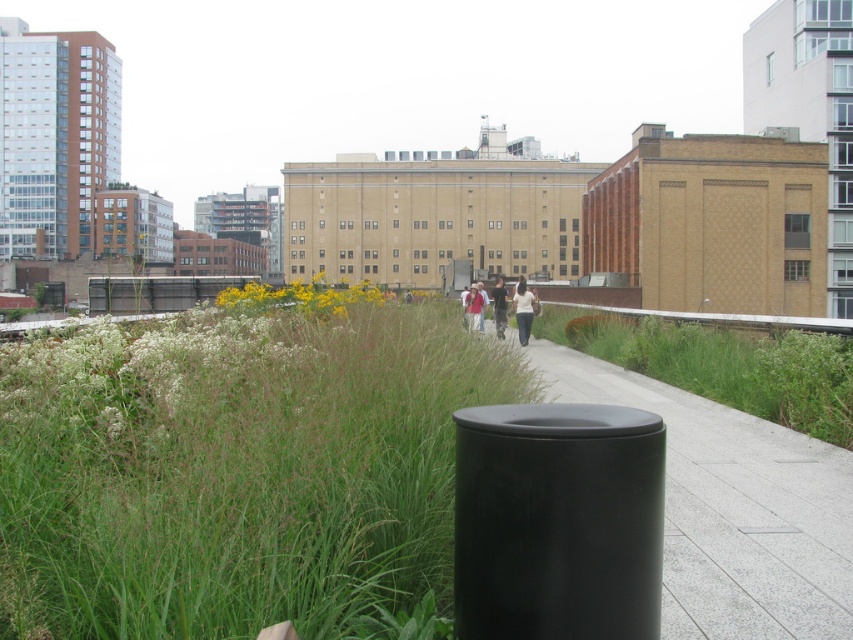
Question: Can you confirm if green grass at center is wider than dark blue shirt at center?

Choices:
 (A) yes
 (B) no

Answer: (B)

Question: Is black concrete pavement at center below dark blue shirt at center?

Choices:
 (A) yes
 (B) no

Answer: (A)

Question: Among these objects, which one is farthest from the camera?

Choices:
 (A) light brown leather jacket at center
 (B) yellow-green flowers at center
 (C) white matte jacket at center
 (D) black concrete pavement at center

Answer: (C)

Question: Which of the following is the farthest from the observer?

Choices:
 (A) (730, 538)
 (B) (517, 301)
 (C) (421, 323)

Answer: (B)

Question: Which of the following is the closest to the observer?

Choices:
 (A) dark blue shirt at center
 (B) black concrete pavement at center

Answer: (B)

Question: Considering the relative positions of green grass at center and yellow-green flowers at center in the image provided, where is green grass at center located with respect to yellow-green flowers at center?

Choices:
 (A) below
 (B) above

Answer: (A)